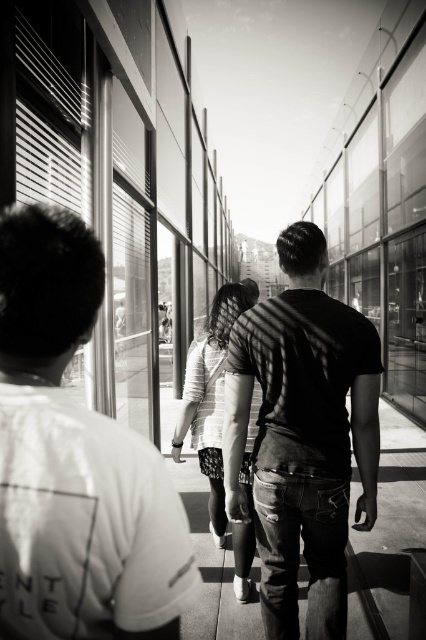
Is ripped denim jeans at center positioned in front of striped fabric at center?

No.

Measure the distance between ripped denim jeans at center and camera.

ripped denim jeans at center is 13.27 feet from camera.

The height and width of the screenshot is (640, 426). Identify the location of ripped denim jeans at center. (388, 534).

Measure the distance between point (2, 618) and camera.

Point (2, 618) and camera are 31.89 inches apart.

Is white cotton shirt at left positioned before striped fabric at center?

Yes, it is.

The height and width of the screenshot is (640, 426). I want to click on white cotton shirt at left, so click(x=74, y=461).

Is white cotton shirt at left positioned behind ripped denim jeans at center?

No, it is not.

Can you confirm if white cotton shirt at left is positioned to the right of ripped denim jeans at center?

No, white cotton shirt at left is not to the right of ripped denim jeans at center.

Between point (13, 288) and point (402, 611), which one is positioned behind?

Point (402, 611)

Locate an element on the screen. white cotton shirt at left is located at coordinates (74, 461).